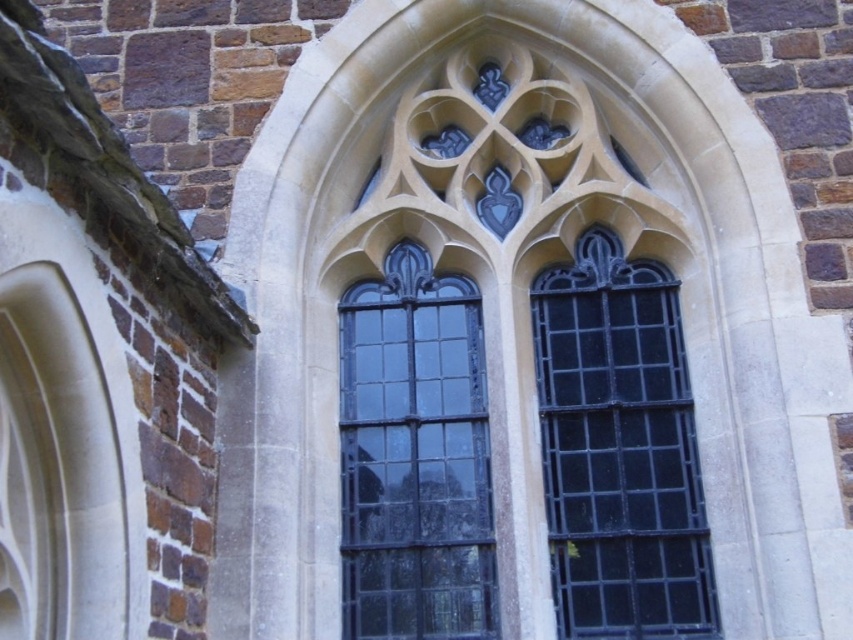
In the scene shown: You are an architect examining the Gothic window. You notice the black metal grid at center and the black glass window at center. Which object is positioned in front of the other?

The black metal grid at center is closer to the viewer than the black glass window at center, so it is positioned in front of the black glass window at center.

You are an architect examining the Gothic window. You need to determine which part of the window is more slender between the black metal grid at center and the black glass window at center. Which one is thinner?

The black metal grid at center is thinner than the black glass window at center according to the description.

You are an architect examining the Gothic window. You need to determine the spatial relationship between the black metal grid at center and the black glass window at center. Which object is located to the right of the other?

The black metal grid at center is positioned on the right side of black glass window at center.